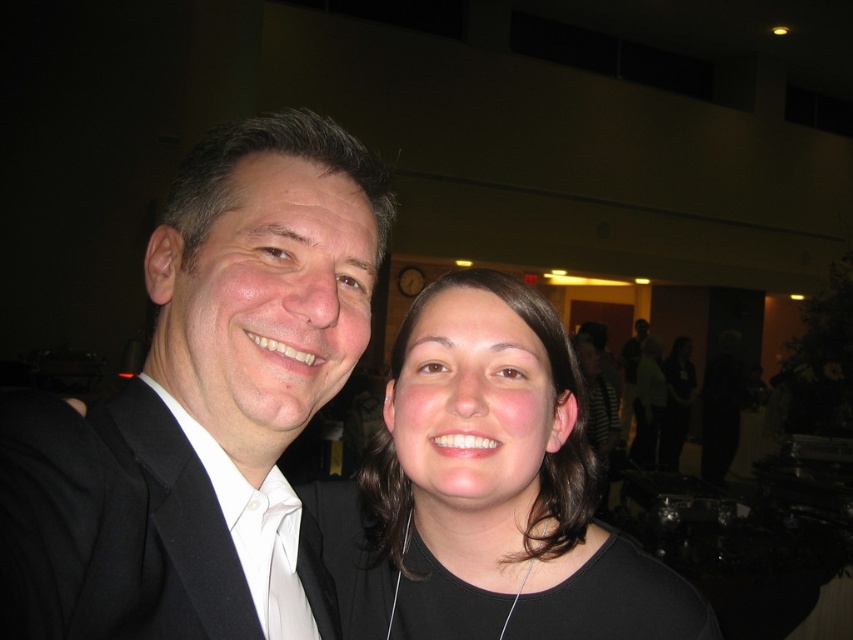
Question: Which object appears farthest from the camera in this image?

Choices:
 (A) black woolen suit at left
 (B) black matte hair at center

Answer: (B)

Question: Which of these objects is positioned farthest from the black woolen suit at left?

Choices:
 (A) white satin tie at center
 (B) black matte suit at left

Answer: (A)

Question: Is black matte hair at center to the right of white satin tie at center from the viewer's perspective?

Choices:
 (A) no
 (B) yes

Answer: (B)

Question: Is black woolen suit at left closer to camera compared to white satin tie at center?

Choices:
 (A) no
 (B) yes

Answer: (B)

Question: Which point appears closest to the camera in this image?

Choices:
 (A) (167, 522)
 (B) (123, 520)
 (C) (463, 632)
 (D) (294, 636)

Answer: (B)

Question: Is black matte suit at left thinner than black matte hair at center?

Choices:
 (A) no
 (B) yes

Answer: (B)